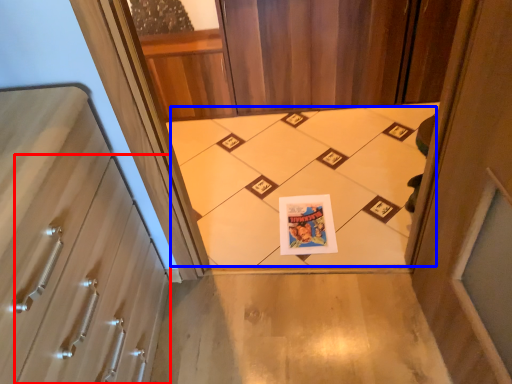
Question: Which object appears farthest to the camera in this image, drawer (highlighted by a red box) or print (highlighted by a blue box)?

Choices:
 (A) drawer
 (B) print

Answer: (B)